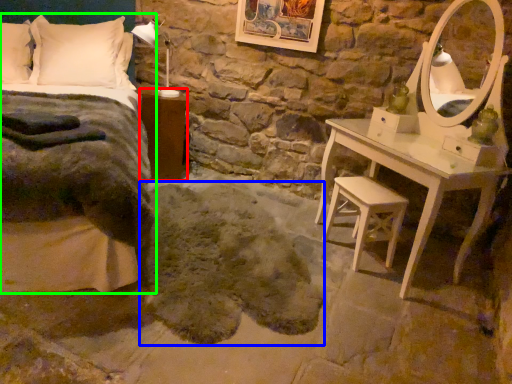
Question: Based on their relative distances, which object is farther from nightstand (highlighted by a red box)? Choose from animal (highlighted by a blue box) and bed (highlighted by a green box).

Choices:
 (A) animal
 (B) bed

Answer: (A)